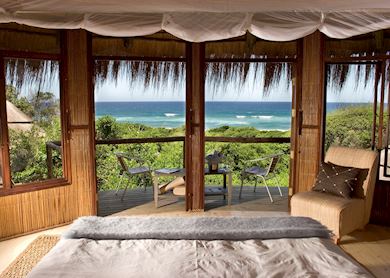
The height and width of the screenshot is (278, 390). I want to click on rug, so click(30, 261).